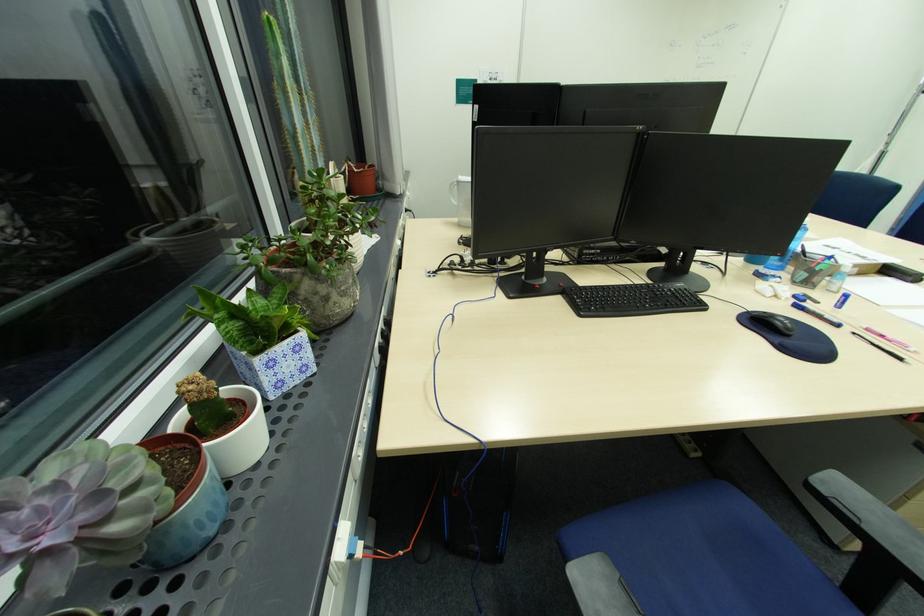
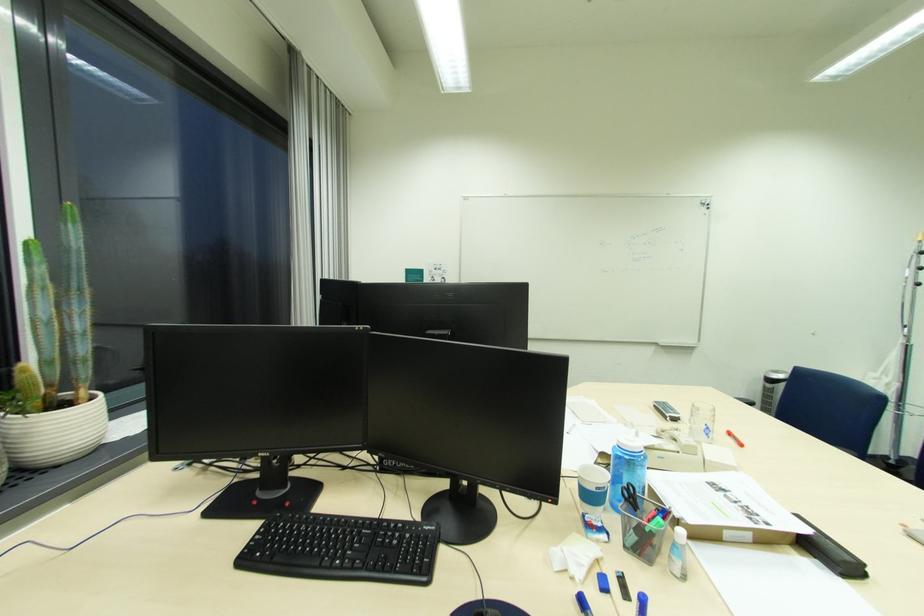
In the second image, find the point that corresponds to [673,294] in the first image.

(396, 541)